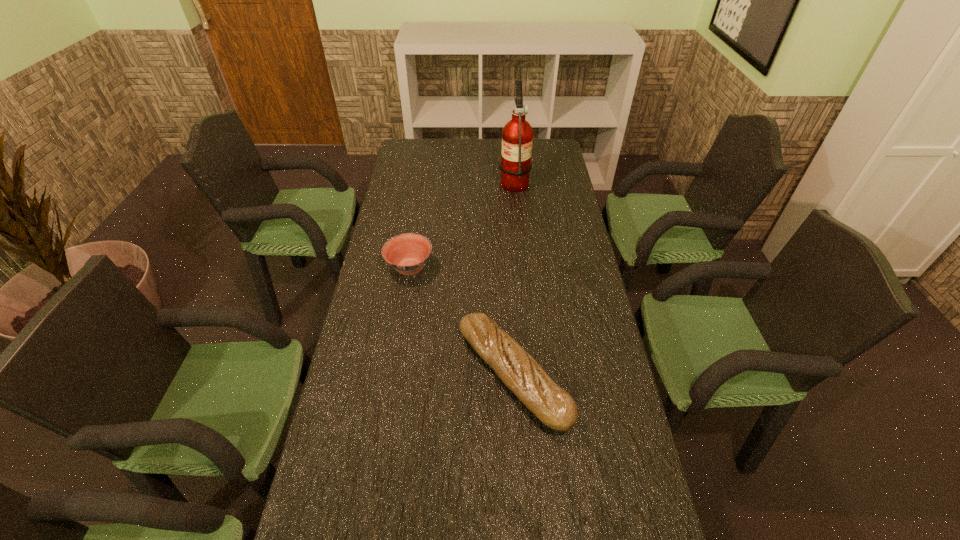
You are a GUI agent. You are given a task and a screenshot of the screen. Output one action in this format:
    pyautogui.click(x=<x>, y=<y>)
    Task: Click on the object situated at the left edge
    Image resolution: width=960 pixels, height=540 pixels.
    Given the screenshot: What is the action you would take?
    pyautogui.click(x=407, y=253)

Image resolution: width=960 pixels, height=540 pixels. What are the coordinates of `fire extinguisher that is at the right edge` in the screenshot? It's located at (517, 136).

Where is `baguet present at the right edge`? This screenshot has width=960, height=540. baguet present at the right edge is located at coordinates (552, 405).

Where is `blank space at the far edge`? blank space at the far edge is located at coordinates (498, 144).

Locate an element on the screen. free space at the left edge is located at coordinates (397, 415).

This screenshot has width=960, height=540. Find the location of `vacant position at the right edge of the desktop`. vacant position at the right edge of the desktop is located at coordinates (555, 356).

Locate an element on the screen. The image size is (960, 540). vacant space at the far left corner of the desktop is located at coordinates (427, 152).

This screenshot has width=960, height=540. Find the location of `empty space between the fire extinguisher and the bowl`. empty space between the fire extinguisher and the bowl is located at coordinates [x=462, y=225].

Identify the location of vacant area between the nearest object and the fire extinguisher. Image resolution: width=960 pixels, height=540 pixels. (514, 278).

The image size is (960, 540). I want to click on free space between the farthest object and the bowl, so click(462, 225).